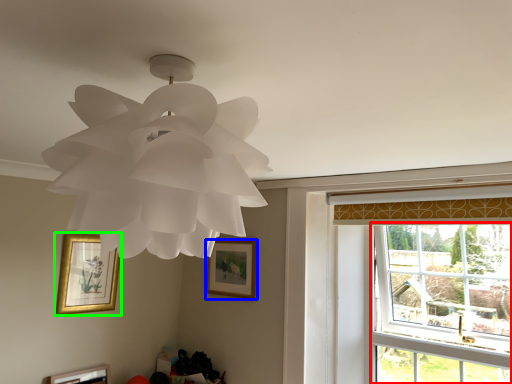
Question: Which object is positioned closest to window (highlighted by a red box)? Select from picture frame (highlighted by a blue box) and picture frame (highlighted by a green box).

Choices:
 (A) picture frame
 (B) picture frame

Answer: (A)